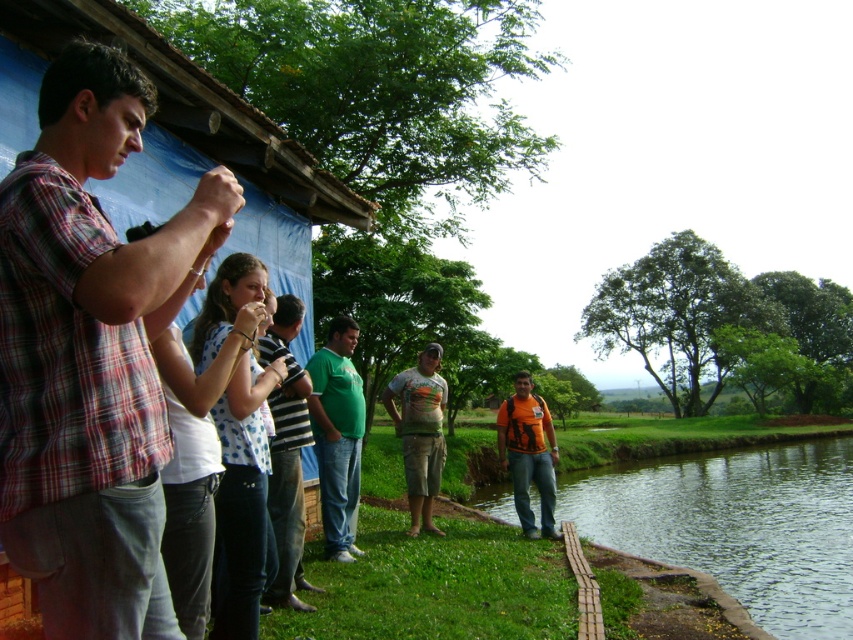
Between clear water at lower right and green matte shirt at center, which one is positioned higher?

green matte shirt at center

Is clear water at lower right thinner than green matte shirt at center?

No, clear water at lower right is not thinner than green matte shirt at center.

Locate an element on the screen. The width and height of the screenshot is (853, 640). clear water at lower right is located at coordinates (737, 525).

Consider the image. Which is below, striped cotton shirt at center or orange fabric backpack at center?

orange fabric backpack at center is below.

Consider the image. Is striped cotton shirt at center above orange fabric backpack at center?

Yes, striped cotton shirt at center is above orange fabric backpack at center.

What do you see at coordinates (286, 452) in the screenshot? I see `striped cotton shirt at center` at bounding box center [286, 452].

Locate an element on the screen. The image size is (853, 640). striped cotton shirt at center is located at coordinates (286, 452).

Can you confirm if striped cotton shirt at center is thinner than green matte shirt at center?

Yes, striped cotton shirt at center is thinner than green matte shirt at center.

This screenshot has height=640, width=853. In order to click on striped cotton shirt at center in this screenshot , I will do `click(286, 452)`.

Locate an element on the screen. The width and height of the screenshot is (853, 640). striped cotton shirt at center is located at coordinates (286, 452).

Where is `striped cotton shirt at center`? The height and width of the screenshot is (640, 853). striped cotton shirt at center is located at coordinates pyautogui.click(x=286, y=452).